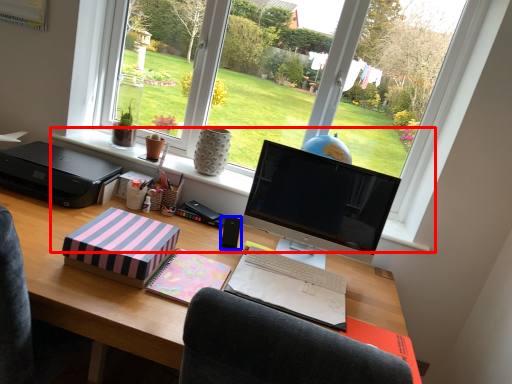
Question: Which of the following is the farthest to the observer, window sill (highlighted by a red box) or speaker (highlighted by a blue box)?

Choices:
 (A) window sill
 (B) speaker

Answer: (A)